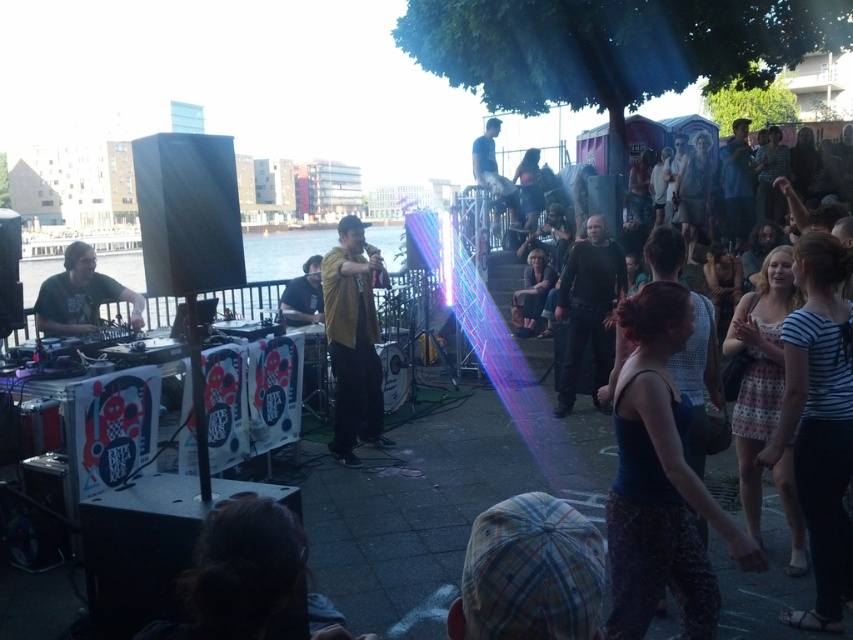
You are a photographer at the waterfront event. You want to capture a photo where both the matte black dj deck at left and the matte yellow shirt at center are clearly visible. Considering their sizes, which object should you focus on to ensure both are in frame?

The matte black dj deck at left is much taller than the matte yellow shirt at center. To ensure both are in frame, focus on the taller matte black dj deck at left, as it requires more space vertically, and the smaller matte yellow shirt at center will naturally fit within the same shot.

You are at the waterfront event and want to take a photo of the DJ booth and the performer. Since you want both the matte black dj deck at left and the dark blue shirt at upper center in the frame, which direction should you move to ensure both are visible?

Since the matte black dj deck at left is to the left of the dark blue shirt at upper center, you should move to the right to ensure both are visible in the frame.

You are standing at the camera position and want to know how far the point at coordinates (61, 284) is from you. Can you determine the distance?

The distance of point (61, 284) from the camera is 5.78 meters.